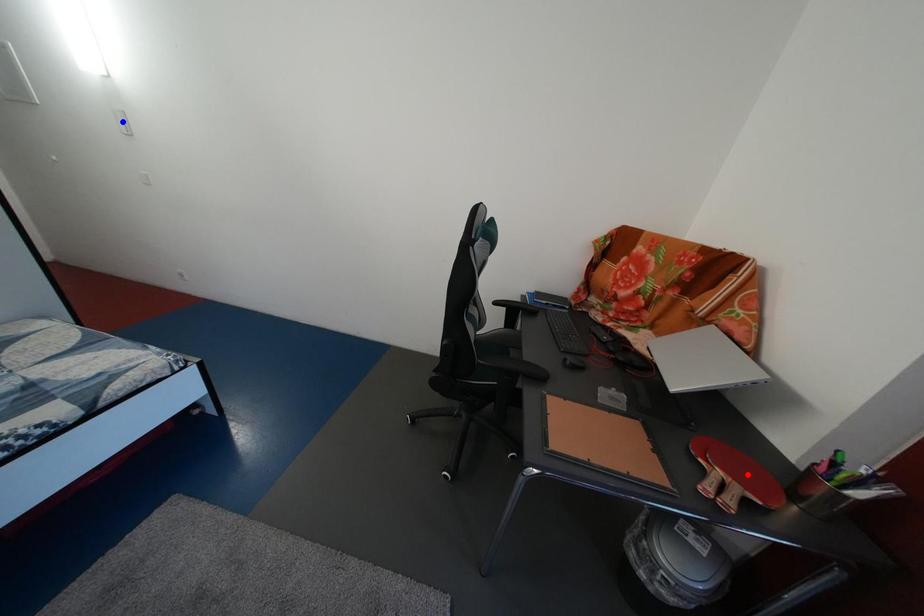
Question: Two points are marked on the image. Which point is closer to the camera?

Choices:
 (A) Blue point is closer.
 (B) Red point is closer.

Answer: (B)